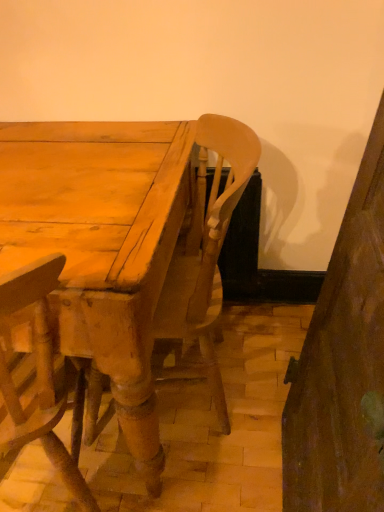
What do you see at coordinates (101, 246) in the screenshot?
I see `wooden table at center` at bounding box center [101, 246].

Find the location of a particular element. The width and height of the screenshot is (384, 512). wooden table at center is located at coordinates (101, 246).

Locate an element on the screen. wooden table at center is located at coordinates (101, 246).